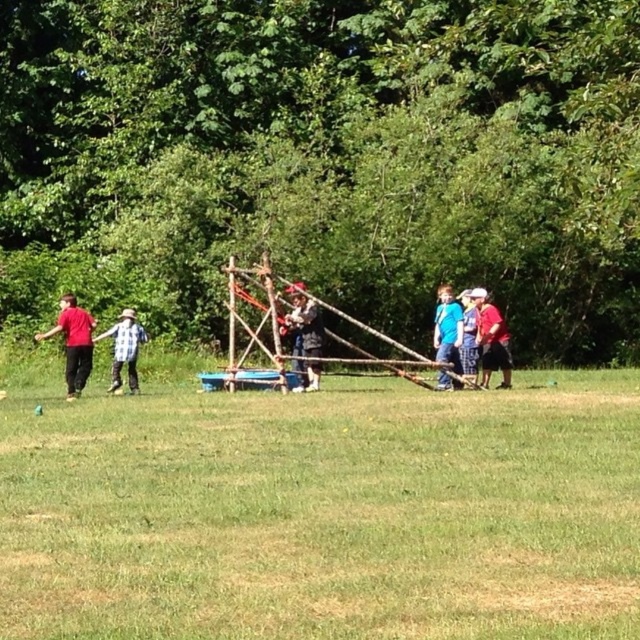
You are a photographer standing at the center of the grassy area. You want to take a photo of both point [317,381] and point [444,294] in the image. Which point will appear larger in your photo?

Point [317,381] will appear larger in the photo because it is closer to the camera than point [444,294].

You are a photographer standing at the center of the grassy area. You want to take a photo that includes both the point at coordinates point (x=298, y=365) and point (x=474, y=353). Which point is closer to your camera?

Point (x=298, y=365) is further to the camera than point (x=474, y=353), so the closer point to your camera is point (x=474, y=353).

You are a parent trying to ensure safety in the park. You notice the wooden stick at center and the blue plaid shorts at center. Which object is larger in size?

The wooden stick at center is bigger than the blue plaid shorts at center according to the description.